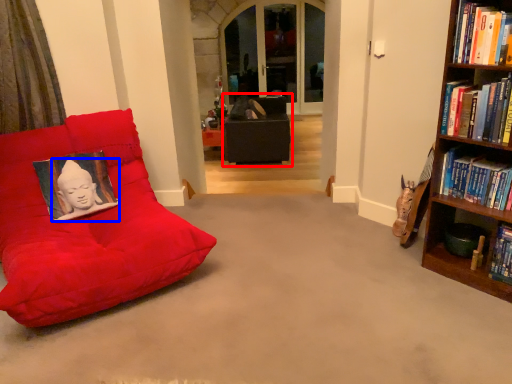
Question: Which object is further to the camera taking this photo, bean bag chair (highlighted by a red box) or person (highlighted by a blue box)?

Choices:
 (A) bean bag chair
 (B) person

Answer: (A)